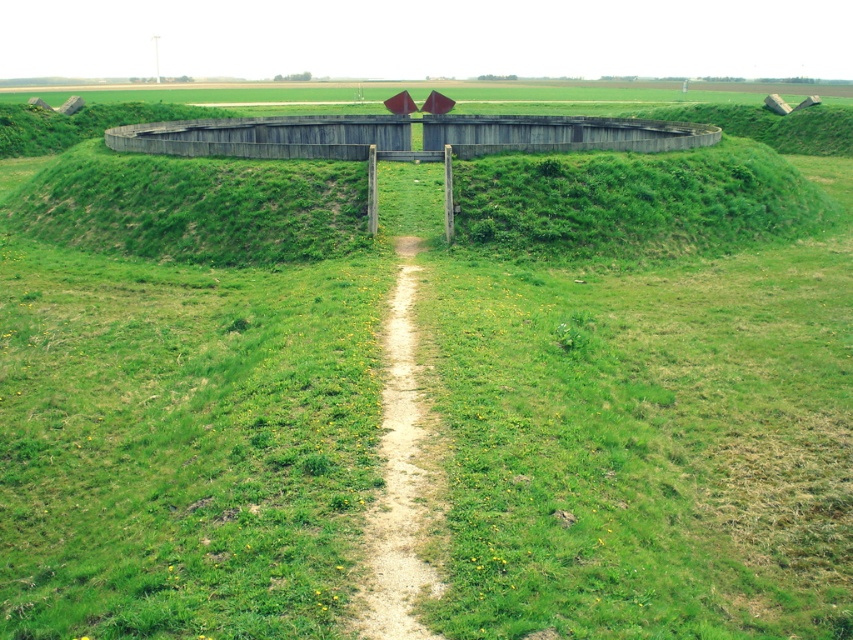
Question: Which object appears farthest from the camera in this image?

Choices:
 (A) dirt/gravel path at center
 (B) wooden fence at center

Answer: (B)

Question: Is wooden fence at center below dirt/gravel path at center?

Choices:
 (A) no
 (B) yes

Answer: (A)

Question: Where is wooden fence at center located in relation to dirt/gravel path at center in the image?

Choices:
 (A) left
 (B) right

Answer: (A)

Question: Does wooden fence at center have a larger size compared to dirt/gravel path at center?

Choices:
 (A) no
 (B) yes

Answer: (B)